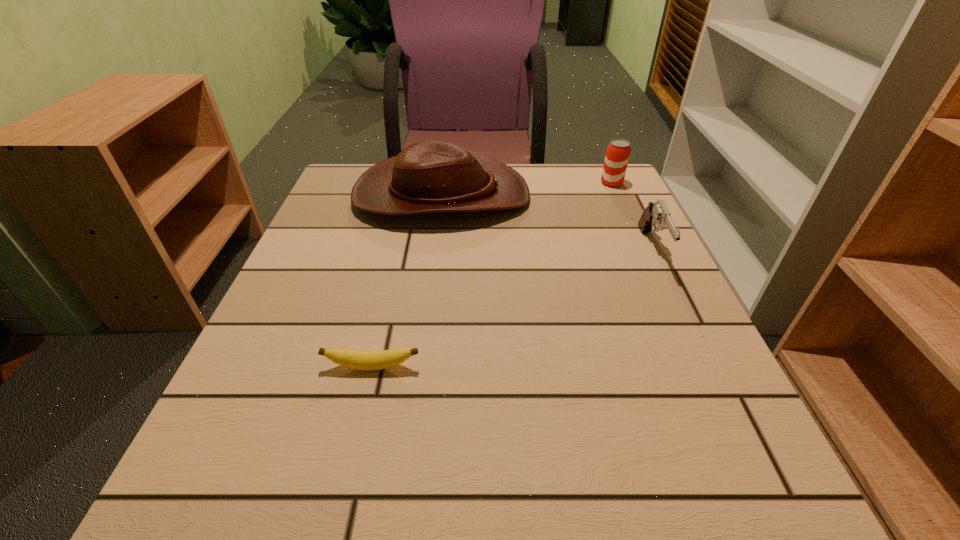
Find the location of a particular element. This screenshot has height=540, width=960. cowboy hat is located at coordinates (428, 176).

The image size is (960, 540). Identify the location of beer can. (618, 151).

I want to click on gun, so click(656, 213).

At what (x,y) coordinates should I click in order to perform the action: click on banana. Please return your answer as a coordinate pair (x, y). Looking at the image, I should click on (358, 359).

At what (x,y) coordinates should I click in order to perform the action: click on the nearest object. Please return your answer as a coordinate pair (x, y). Looking at the image, I should click on (358, 359).

Locate an element on the screen. The width and height of the screenshot is (960, 540). vacant space located on the front-facing side of the cowboy hat is located at coordinates (575, 195).

This screenshot has width=960, height=540. In order to click on free location located on the front of the beer can in this screenshot , I will do `click(638, 240)`.

Identify the location of vacant space positioned at the muzzle of the gun. (764, 480).

Locate an element on the screen. Image resolution: width=960 pixels, height=540 pixels. blank space located on the front of the banana is located at coordinates (345, 484).

Where is `cowboy hat that is at the far edge`? The width and height of the screenshot is (960, 540). cowboy hat that is at the far edge is located at coordinates (428, 176).